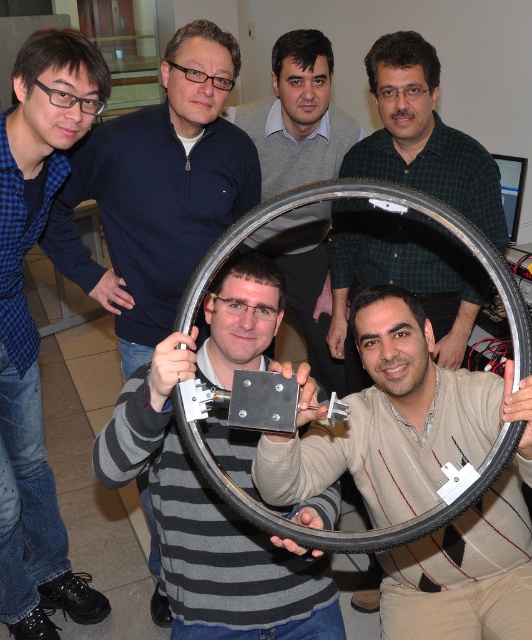
Is blue checkered shirt at left positioned at the back of metallic gray rim at center?

Yes, blue checkered shirt at left is behind metallic gray rim at center.

Is blue checkered shirt at left thinner than metallic gray rim at center?

Yes, blue checkered shirt at left is thinner than metallic gray rim at center.

I want to click on blue checkered shirt at left, so click(36, 326).

This screenshot has height=640, width=532. What do you see at coordinates (297, 116) in the screenshot?
I see `gray sweater at center` at bounding box center [297, 116].

Is gray sweater at center wider than metallic gray rim at center?

Incorrect, gray sweater at center's width does not surpass metallic gray rim at center's.

Find the location of a particular element. The image size is (532, 640). gray sweater at center is located at coordinates (297, 116).

Who is more distant from viewer, (128, 426) or (49, 29)?

The point (49, 29) is behind.

Is point (286, 540) more distant than point (78, 51)?

That is False.

The height and width of the screenshot is (640, 532). Find the location of `gray striped sweater at center`. gray striped sweater at center is located at coordinates (210, 486).